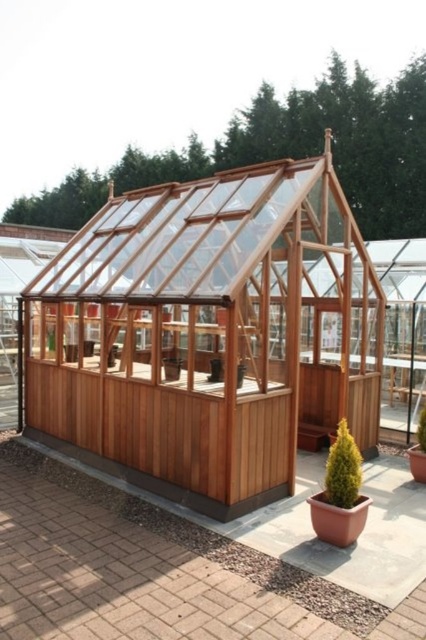
Between point (350, 445) and point (420, 410), which one is positioned behind?

Point (420, 410)

Which is behind, point (351, 474) or point (419, 433)?

Positioned behind is point (419, 433).

Find the location of `green textured cone at lower right`. green textured cone at lower right is located at coordinates (342, 468).